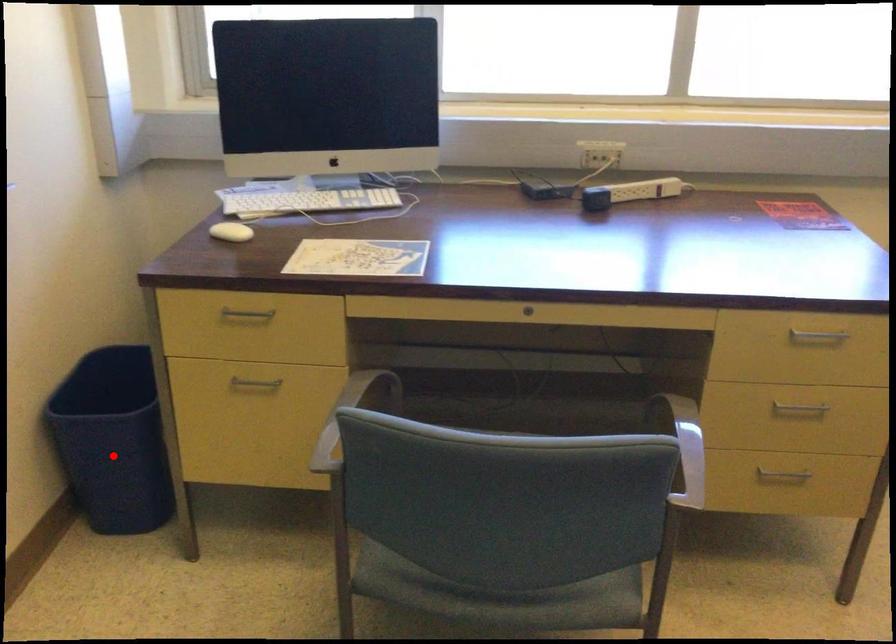
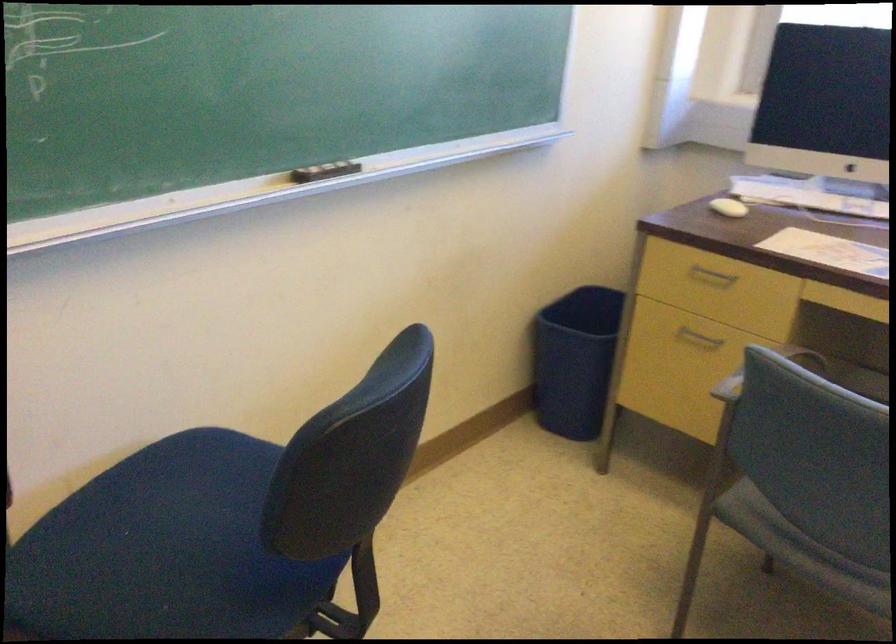
Where in the second image is the point corresponding to the highlighted location from the first image?

(574, 360)